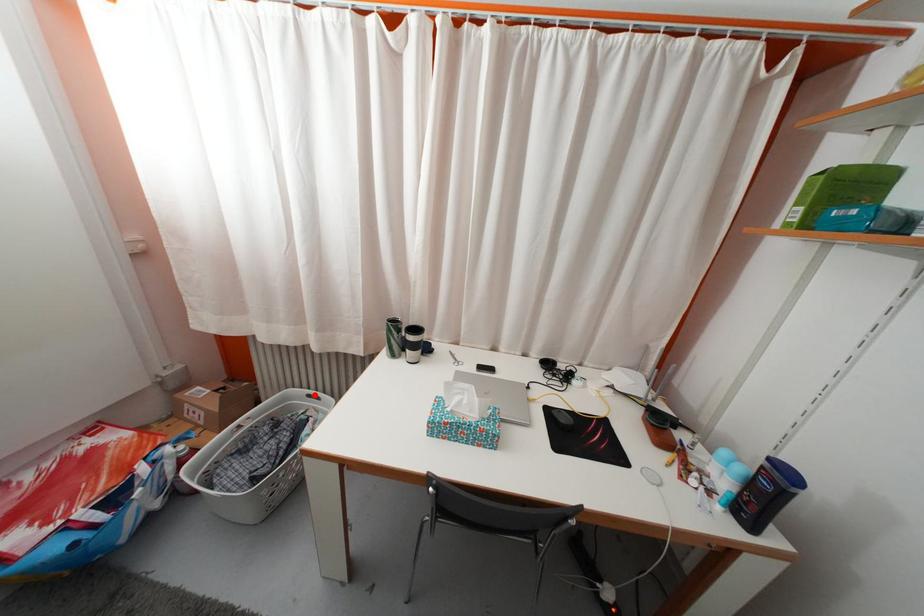
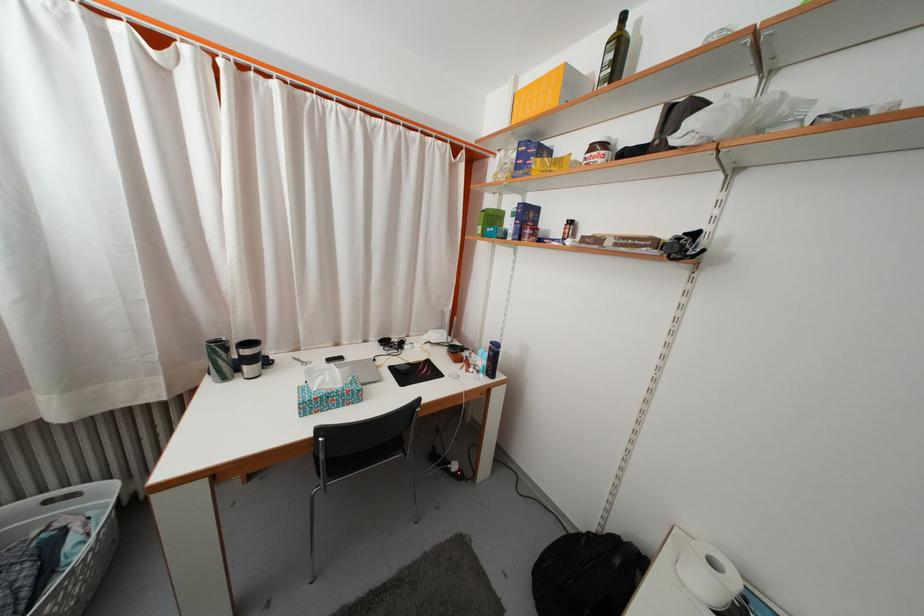
Question: I am providing you with two images of the same scene from different viewpoints. A red point is shown in image1. For the corresponding object point in image2, is it positioned nearer or farther from the camera?

Choices:
 (A) Nearer
 (B) Farther

Answer: (A)